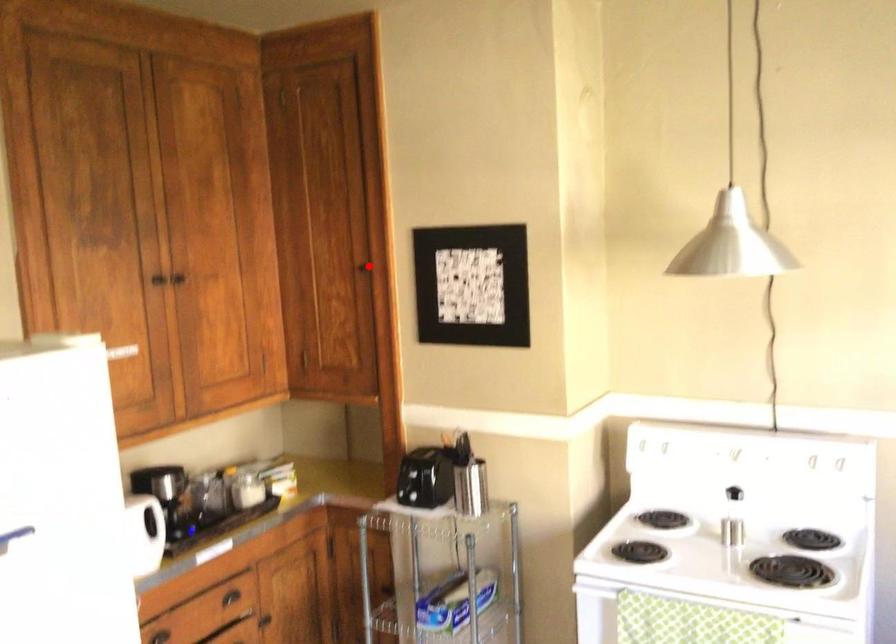
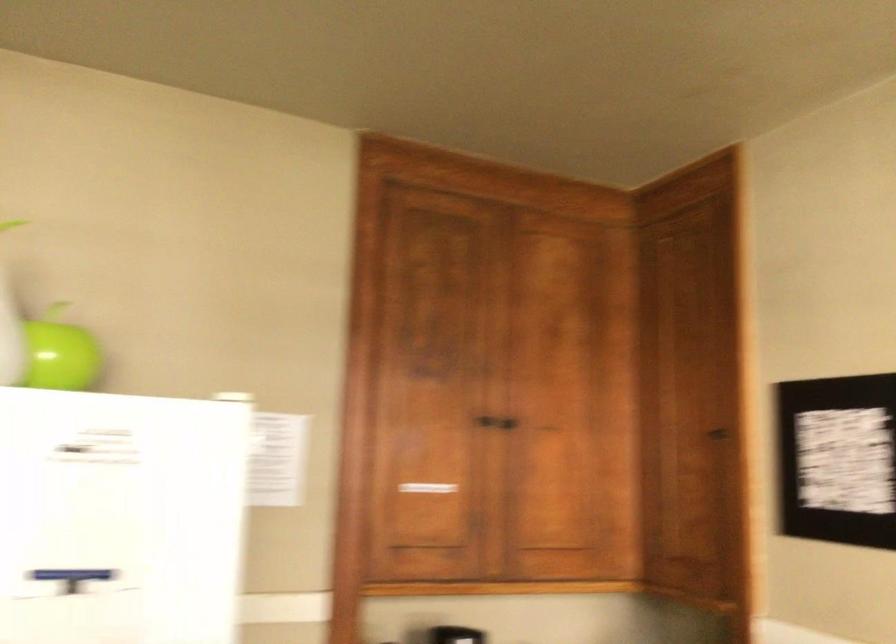
Question: I am providing you with two images of the same scene from different viewpoints. Given a red point in image1, look at the same physical point in image2. Is it:

Choices:
 (A) Closer to the viewpoint
 (B) Farther from the viewpoint

Answer: (A)